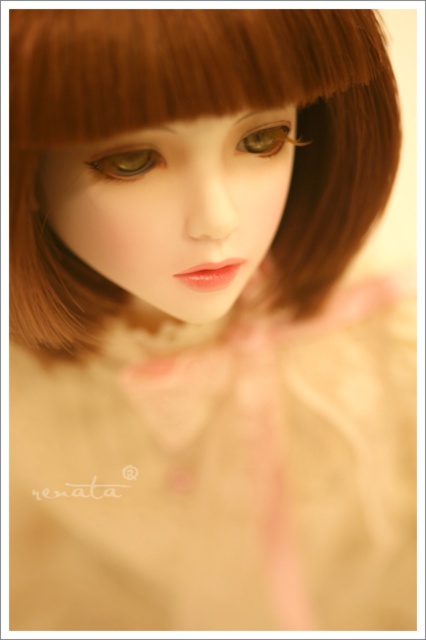
Is green matte eye at center further to camera compared to brown matte eye at center?

No, it is not.

Is green matte eye at center bigger than brown matte eye at center?

No, green matte eye at center is not bigger than brown matte eye at center.

Is point (149, 161) positioned behind point (256, 131)?

No, it is not.

Where is `green matte eye at center`? This screenshot has height=640, width=426. green matte eye at center is located at coordinates (126, 163).

Can you confirm if brown matte hair at upper center is wider than smooth porcelain face at center?

Yes.

Is point (304, 24) positioned after point (256, 161)?

No.

Locate an element on the screen. The width and height of the screenshot is (426, 640). brown matte hair at upper center is located at coordinates (175, 65).

Based on the photo, between brown matte hair at upper center and brown matte eye at center, which one is positioned lower?

brown matte eye at center is lower down.

Who is more distant from viewer, (222, 112) or (268, 140)?

Point (268, 140)

What do you see at coordinates (175, 65) in the screenshot? I see `brown matte hair at upper center` at bounding box center [175, 65].

The width and height of the screenshot is (426, 640). I want to click on brown matte hair at upper center, so click(x=175, y=65).